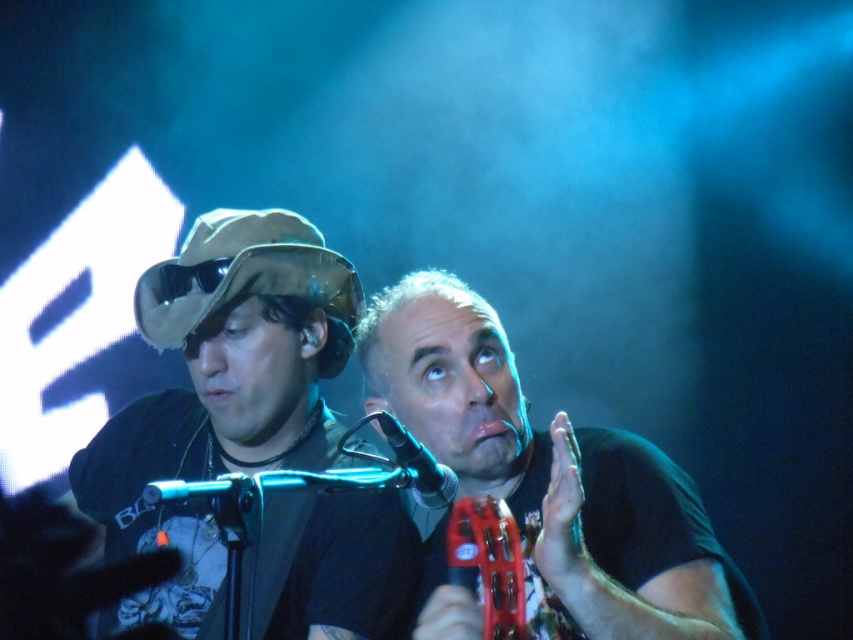
Which of these two, matte brown hat at left or matte black tambourine at center, stands taller?

matte brown hat at left

Which is behind, point (340, 268) or point (671, 628)?

Point (340, 268)

Describe the element at coordinates (219, 396) in the screenshot. I see `matte brown hat at left` at that location.

In order to click on matte brown hat at left in this screenshot , I will do `click(219, 396)`.